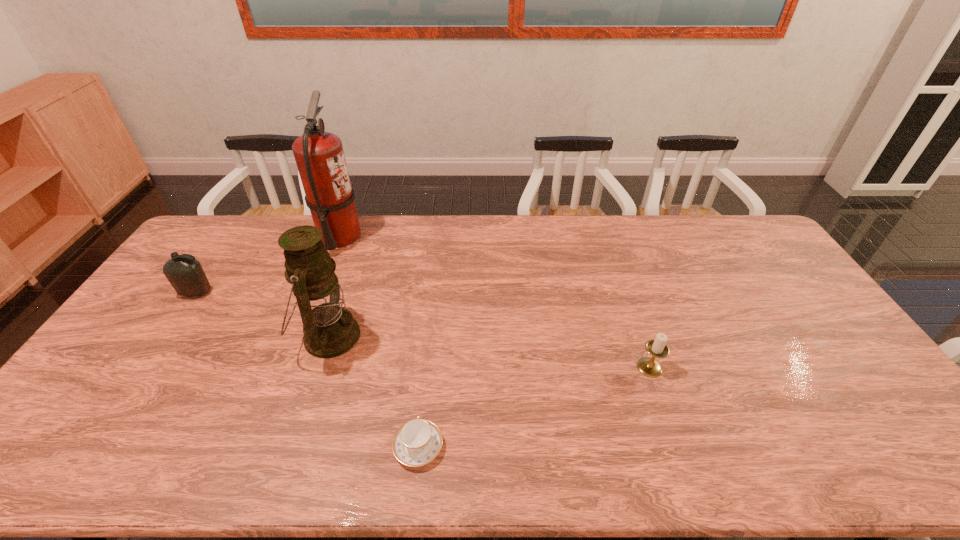
Where is `vacant space situated on the left of the fourth shortest object`? The height and width of the screenshot is (540, 960). vacant space situated on the left of the fourth shortest object is located at coordinates (189, 336).

At what (x,y) coordinates should I click in order to perform the action: click on blank space located on the back of the third shortest object. Please return your answer as a coordinate pair (x, y). The image size is (960, 540). Looking at the image, I should click on (238, 231).

Locate an element on the screen. Image resolution: width=960 pixels, height=540 pixels. free space located on the left of the candle holder is located at coordinates (604, 367).

Identify the location of free region located 0.170m on the side with the handle of the shortest object. (427, 367).

Identify the location of vacant space located 0.210m on the side with the handle of the shortest object. (428, 355).

The width and height of the screenshot is (960, 540). In order to click on free point located 0.160m on the side with the handle of the shortest object in this screenshot , I will do tap(426, 370).

Where is `object that is at the far edge`? The height and width of the screenshot is (540, 960). object that is at the far edge is located at coordinates pos(319,155).

Where is `object at the near edge`? object at the near edge is located at coordinates (416, 443).

This screenshot has width=960, height=540. I want to click on object present at the left edge, so click(x=186, y=275).

In the image, there is a desktop. Where is `free space at the far edge`? free space at the far edge is located at coordinates (540, 234).